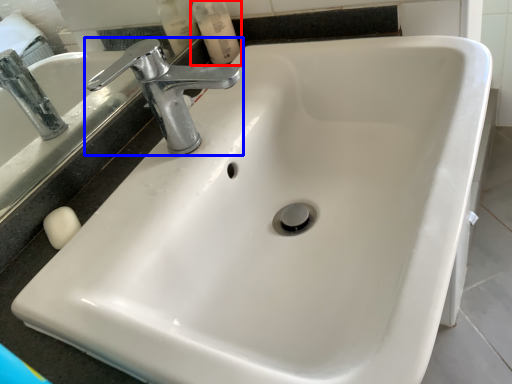
Question: Which point is further to the camera, mouthwash (highlighted by a red box) or tap (highlighted by a blue box)?

Choices:
 (A) mouthwash
 (B) tap

Answer: (A)